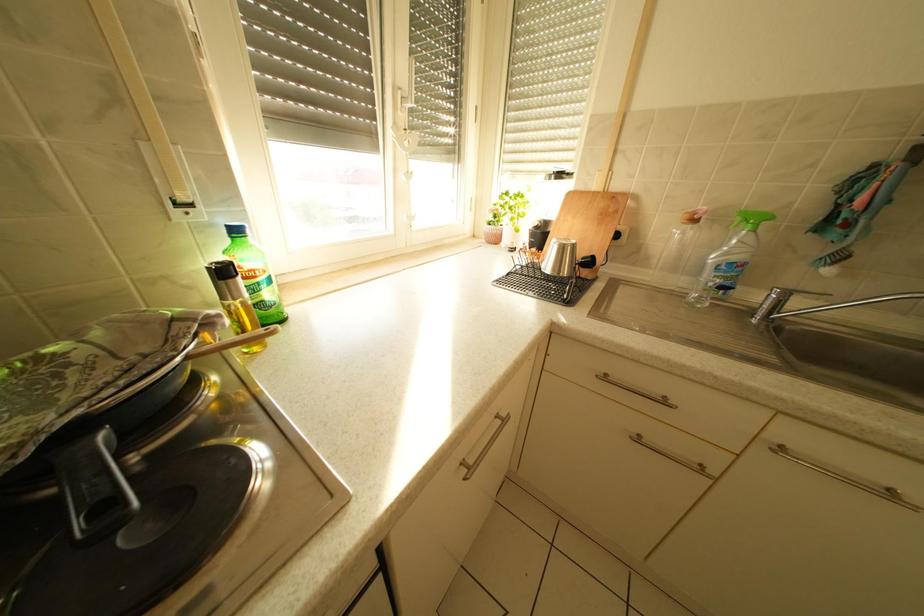
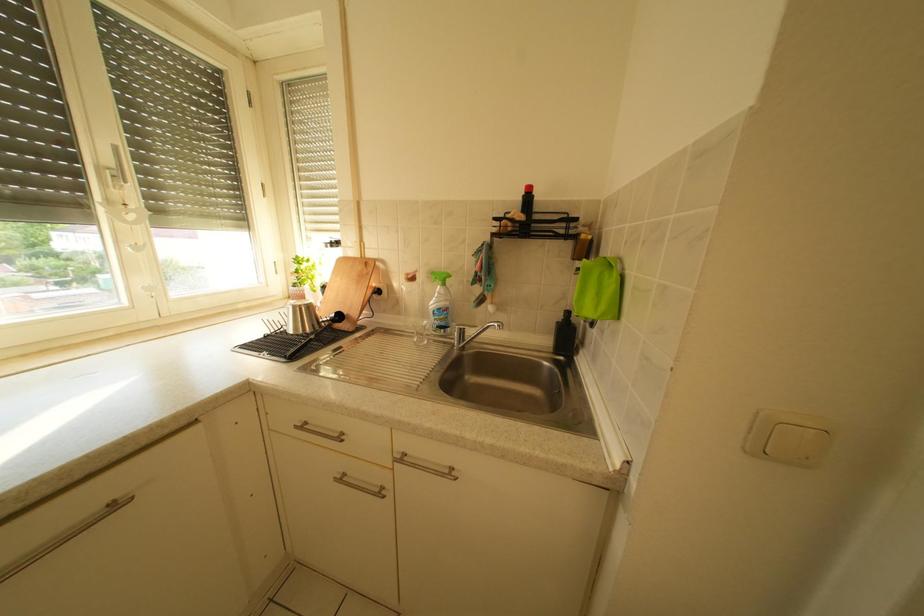
Question: How did the camera likely rotate?

Choices:
 (A) Left
 (B) Right
 (C) Up
 (D) Down

Answer: (B)